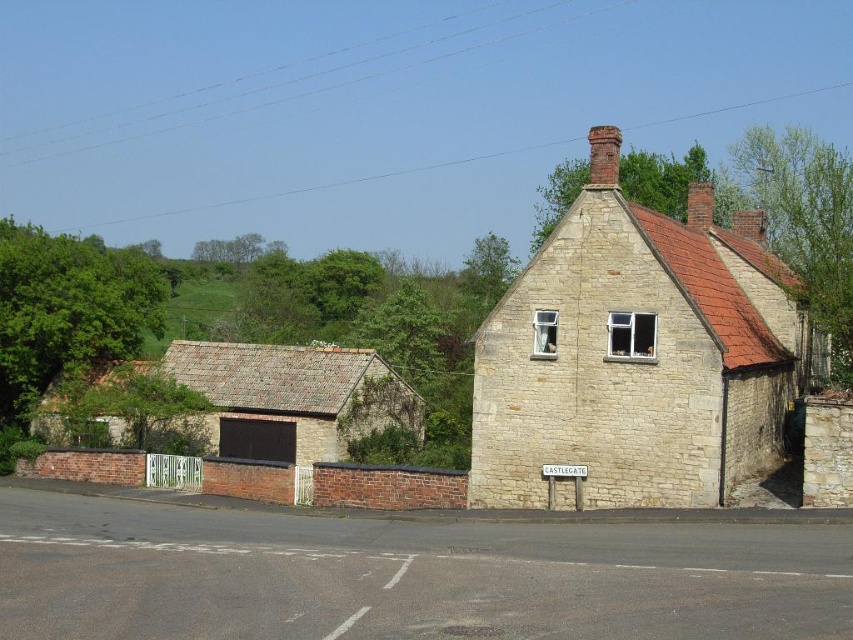
Is stone cottage at center taller than stone brick cottage at lower left?

Correct, stone cottage at center is much taller as stone brick cottage at lower left.

Who is shorter, stone cottage at center or stone brick cottage at lower left?

stone brick cottage at lower left

This screenshot has height=640, width=853. What do you see at coordinates (634, 356) in the screenshot? I see `stone cottage at center` at bounding box center [634, 356].

At what (x,y) coordinates should I click in order to perform the action: click on stone cottage at center. Please return your answer as a coordinate pair (x, y). Looking at the image, I should click on (634, 356).